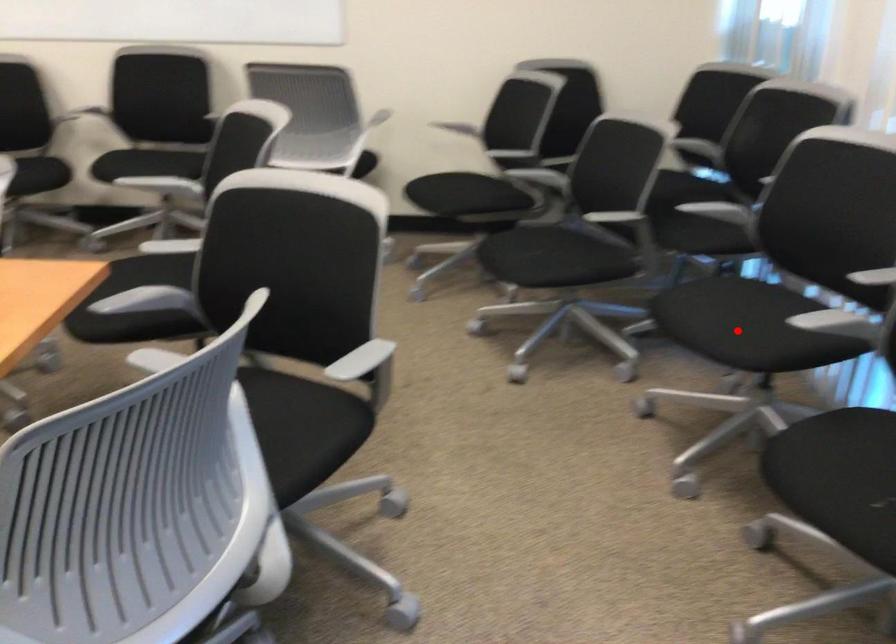
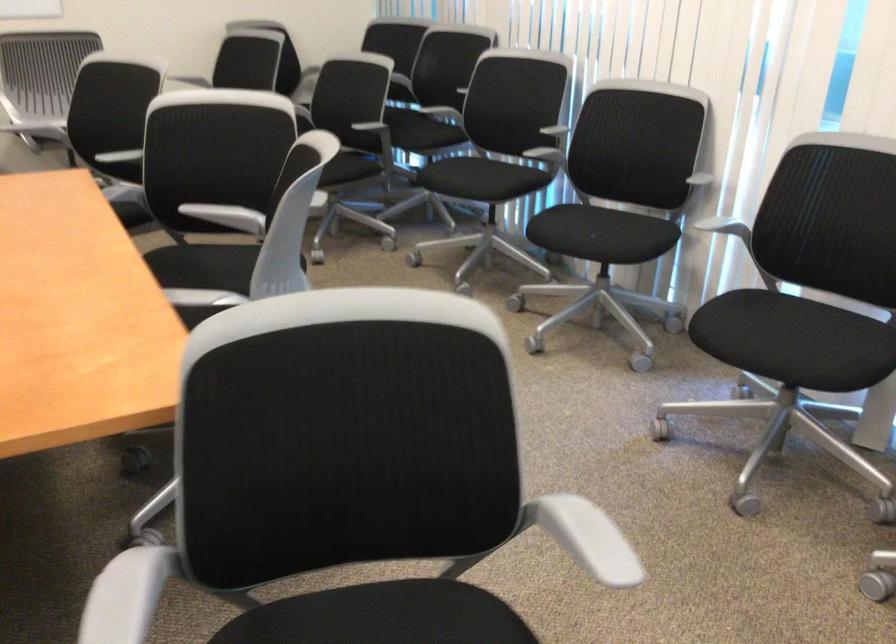
Question: I am providing you with two images of the same scene from different viewpoints. In image1, a red point is highlighted. Considering the same 3D point in image2, which of the following is correct?

Choices:
 (A) It is closer
 (B) It is farther

Answer: (B)